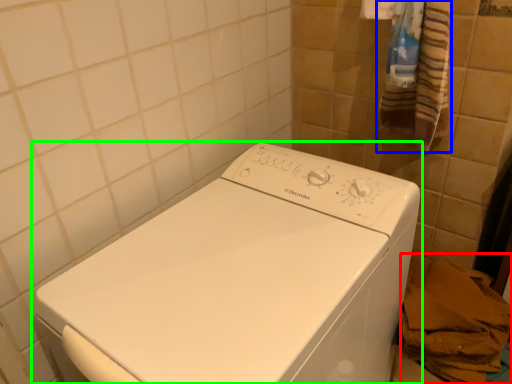
Question: Estimate the real-world distances between objects in this image. Which object is closer to material (highlighted by a red box), bath towel (highlighted by a blue box) or washing machine (highlighted by a green box)?

Choices:
 (A) bath towel
 (B) washing machine

Answer: (B)